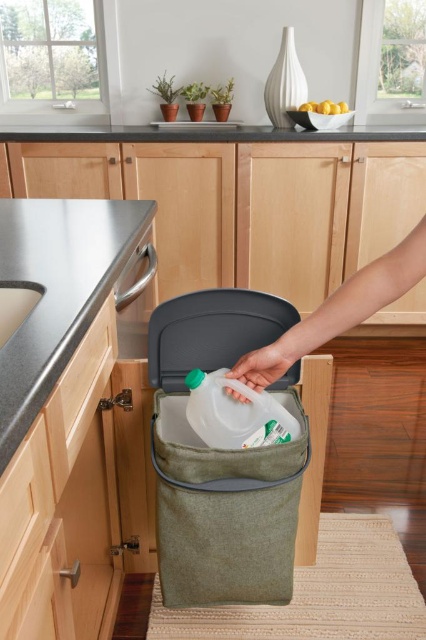
Identify the location of satin steel countertop at upper center. (207, 132).

Who is positioned more to the right, satin steel countertop at upper center or translucent plastic bottle at center?

translucent plastic bottle at center is more to the right.

Is point (170, 140) farther from viewer compared to point (190, 390)?

Yes, point (170, 140) is farther from viewer.

The height and width of the screenshot is (640, 426). Find the location of `satin steel countertop at upper center`. satin steel countertop at upper center is located at coordinates click(x=207, y=132).

Who is higher up, stainless steel countertop at upper left or translucent plastic bottle at center?

stainless steel countertop at upper left is above.

Is stainless steel countertop at upper left thinner than translucent plastic bottle at center?

No, stainless steel countertop at upper left is not thinner than translucent plastic bottle at center.

What do you see at coordinates (57, 291) in the screenshot? I see `stainless steel countertop at upper left` at bounding box center [57, 291].

This screenshot has width=426, height=640. I want to click on stainless steel countertop at upper left, so (x=57, y=291).

Who is positioned more to the right, stainless steel countertop at upper left or satin steel countertop at upper center?

Positioned to the right is satin steel countertop at upper center.

Can you confirm if stainless steel countertop at upper left is thinner than satin steel countertop at upper center?

Yes.

Is point (69, 275) behind point (279, 134)?

No, (69, 275) is in front of (279, 134).

Identify the location of stainless steel countertop at upper left. This screenshot has width=426, height=640. (57, 291).